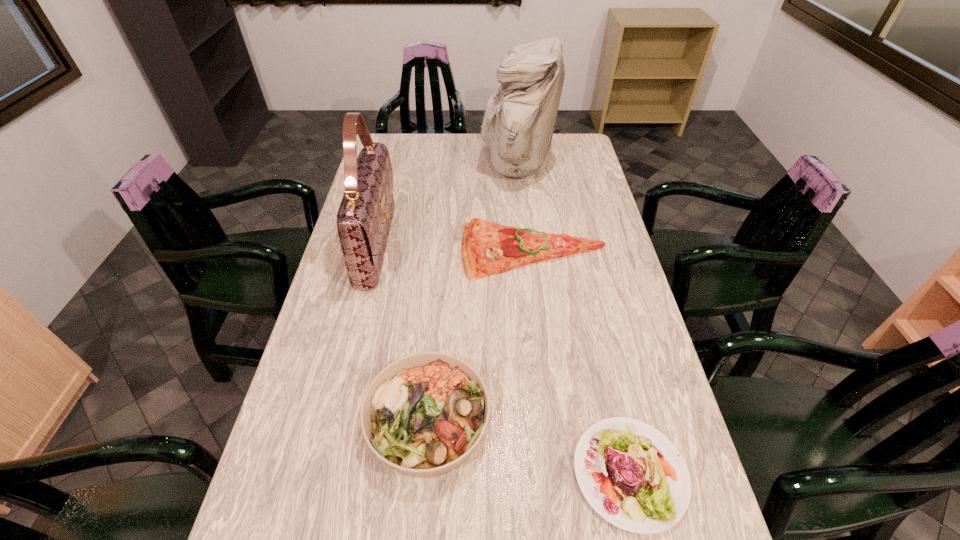
Image resolution: width=960 pixels, height=540 pixels. Identify the location of the farthest object. (519, 120).

Find the location of `handbag`. handbag is located at coordinates (364, 218).

Find the location of a particular element. The height and width of the screenshot is (540, 960). the taller salad plate is located at coordinates (424, 414).

Identify the location of the left salad plate. (424, 414).

You are a GUI agent. You are given a task and a screenshot of the screen. Output one action in this format:
    pyautogui.click(x=<x>, y=<y>)
    Task: Click on the pizza
    
    Given the screenshot: What is the action you would take?
    [487, 248]

The image size is (960, 540). I want to click on the right salad plate, so click(x=632, y=475).

The height and width of the screenshot is (540, 960). What are the coordinates of `free point located 0.120m on the front-facing side of the farthest object` in the screenshot? It's located at (451, 165).

Locate an element on the screen. This screenshot has width=960, height=540. vacant area situated on the front-facing side of the farthest object is located at coordinates (399, 165).

Locate an element on the screen. free space located 0.190m on the front-facing side of the farthest object is located at coordinates (434, 165).

Where is `vacant space located 0.360m on the front of the handbag with the clasp`? vacant space located 0.360m on the front of the handbag with the clasp is located at coordinates (502, 245).